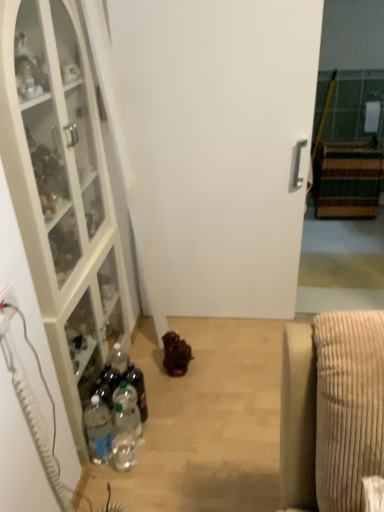
You are a GUI agent. You are given a task and a screenshot of the screen. Output one action in this format:
    pyautogui.click(x=<x>, y=<y>)
    Task: Click on the free space in front of clear plastic bottle at lower left, which is the 3th bottle from right to left
    
    Given the screenshot: What is the action you would take?
    pyautogui.click(x=113, y=485)